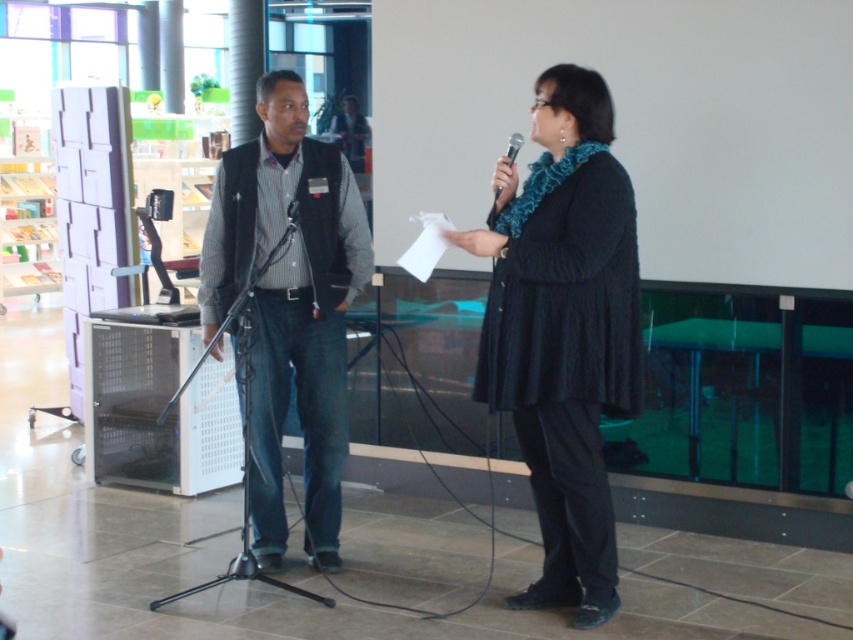
Question: Does black knitted sweater at center appear on the right side of black plastic microphone at upper center?

Choices:
 (A) no
 (B) yes

Answer: (B)

Question: Which object is closer to the camera taking this photo?

Choices:
 (A) black knitted sweater at center
 (B) matte black vest at center

Answer: (A)

Question: Can you confirm if black knitted sweater at center is positioned below black plastic microphone at upper center?

Choices:
 (A) yes
 (B) no

Answer: (A)

Question: Which point is closer to the camera?

Choices:
 (A) (498, 282)
 (B) (273, 298)

Answer: (A)

Question: Can you confirm if black knitted sweater at center is bigger than black plastic microphone at upper center?

Choices:
 (A) yes
 (B) no

Answer: (A)

Question: Which object is farther from the camera taking this photo?

Choices:
 (A) matte black vest at center
 (B) black plastic microphone at upper center
 (C) black knitted sweater at center

Answer: (A)